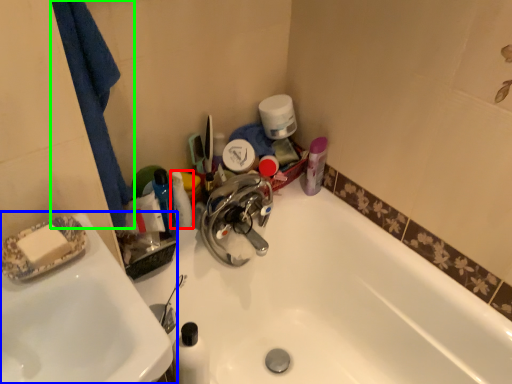
Question: Based on their relative distances, which object is nearer to toiletry (highlighted by a red box)? Choose from sink (highlighted by a blue box) and bath towel (highlighted by a green box).

Choices:
 (A) sink
 (B) bath towel

Answer: (B)